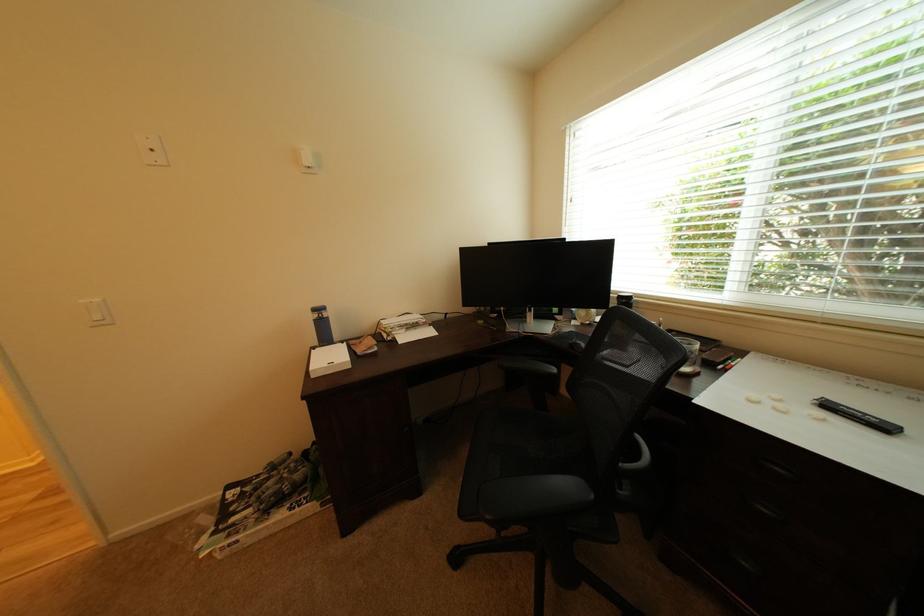
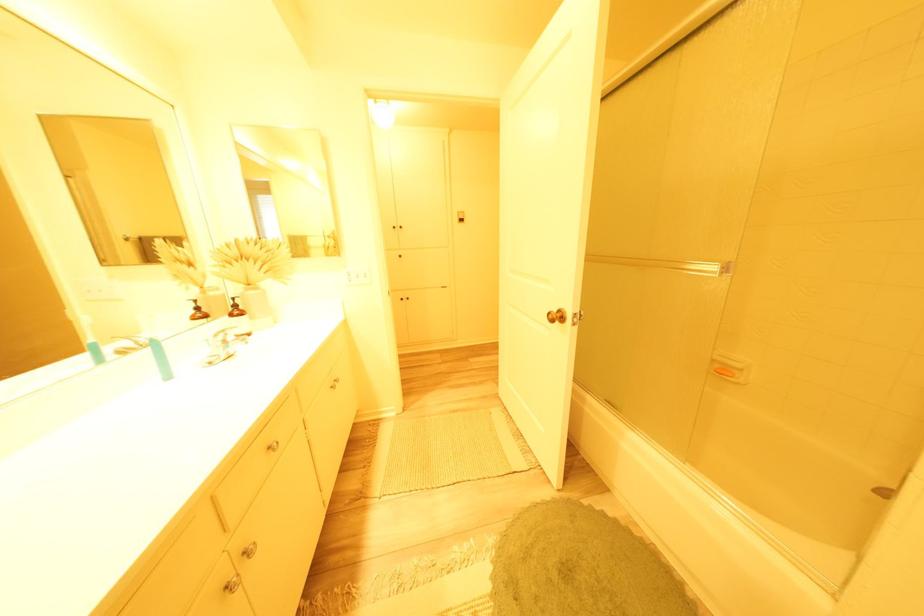
The images are taken continuously from a first-person perspective. In which direction are you moving?

The cameraman moved toward left, backward.